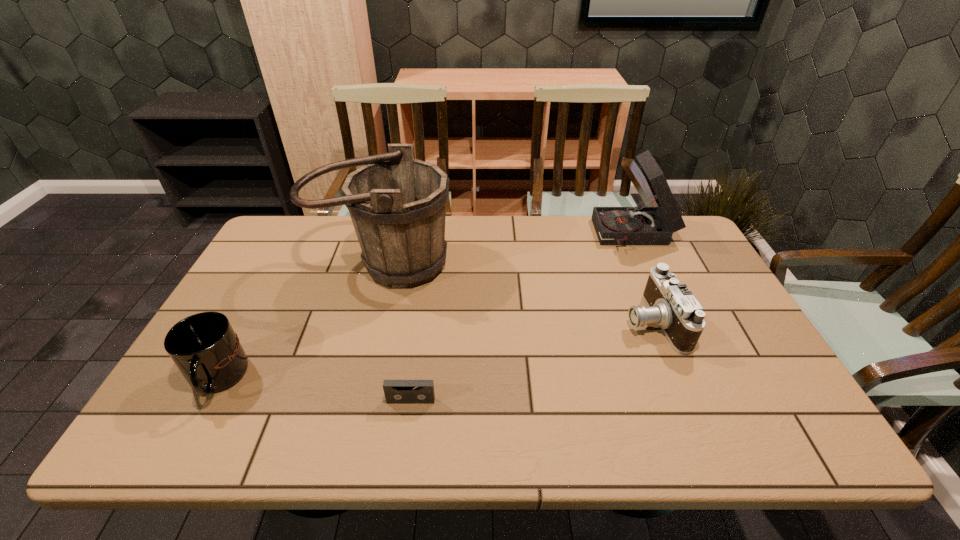
In order to click on blank space at the near edge of the desktop in this screenshot , I will do `click(570, 439)`.

Find the location of `free space at the left edge`. free space at the left edge is located at coordinates (284, 284).

This screenshot has width=960, height=540. Find the location of `free space at the far left corner of the desktop`. free space at the far left corner of the desktop is located at coordinates (278, 239).

You are a GUI agent. You are given a task and a screenshot of the screen. Output one action in this format:
    pyautogui.click(x=<x>, y=<y>)
    Task: Click on the unoccupied position between the shortest object and the leftmost object
    
    Given the screenshot: What is the action you would take?
    pyautogui.click(x=314, y=390)

This screenshot has width=960, height=540. I want to click on free space between the leftmost object and the tallest object, so click(300, 321).

Locate an element on the screen. This screenshot has width=960, height=540. vacant point located between the bucket and the mug is located at coordinates (300, 321).

The height and width of the screenshot is (540, 960). Identify the location of blank region between the fourth shortest object and the bucket. (510, 249).

This screenshot has height=540, width=960. In order to click on free spot between the camera and the mug in this screenshot , I will do `click(435, 350)`.

Where is `free space between the camera and the mug`? This screenshot has height=540, width=960. free space between the camera and the mug is located at coordinates (435, 350).

Find the location of a particular element. vacant point located between the videotape and the leftmost object is located at coordinates (314, 390).